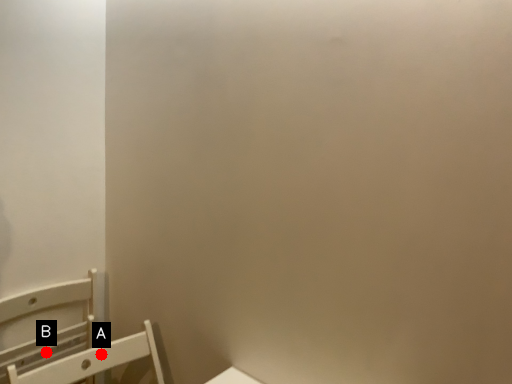
Question: Two points are circled on the image, labeled by A and B beside each circle. Which point appears closest to the camera in this image?

Choices:
 (A) A is closer
 (B) B is closer

Answer: (A)